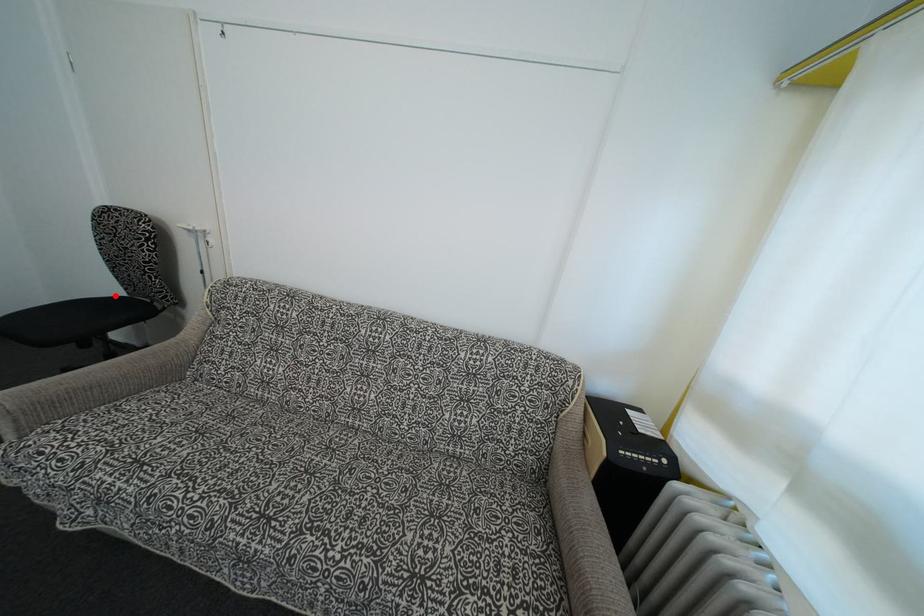
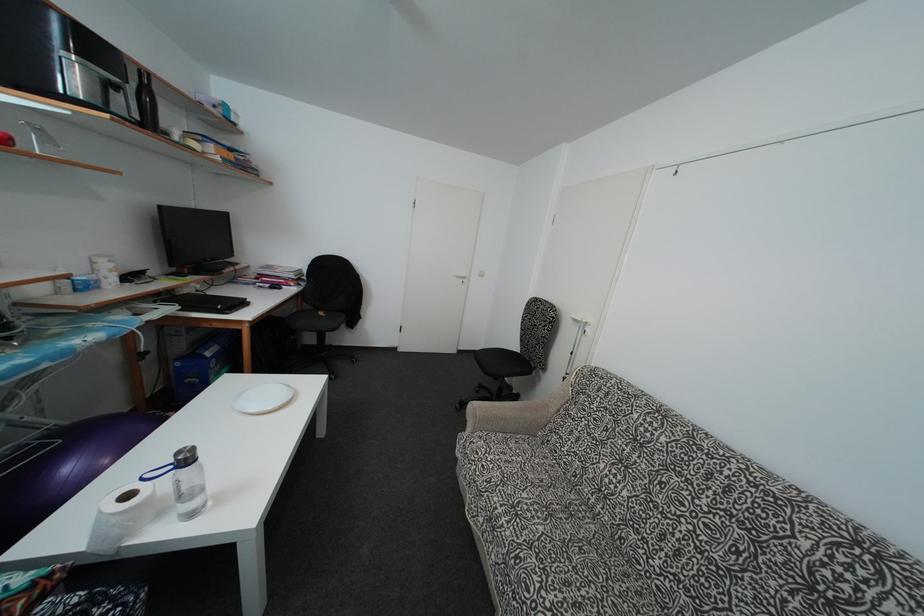
In the second image, find the point that corresponds to the highlighted location in the first image.

(517, 353)